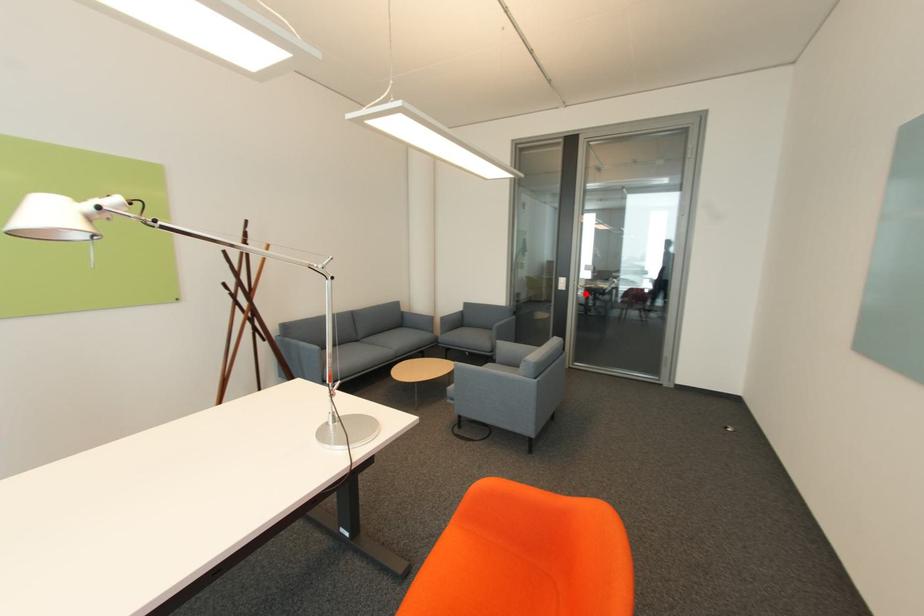
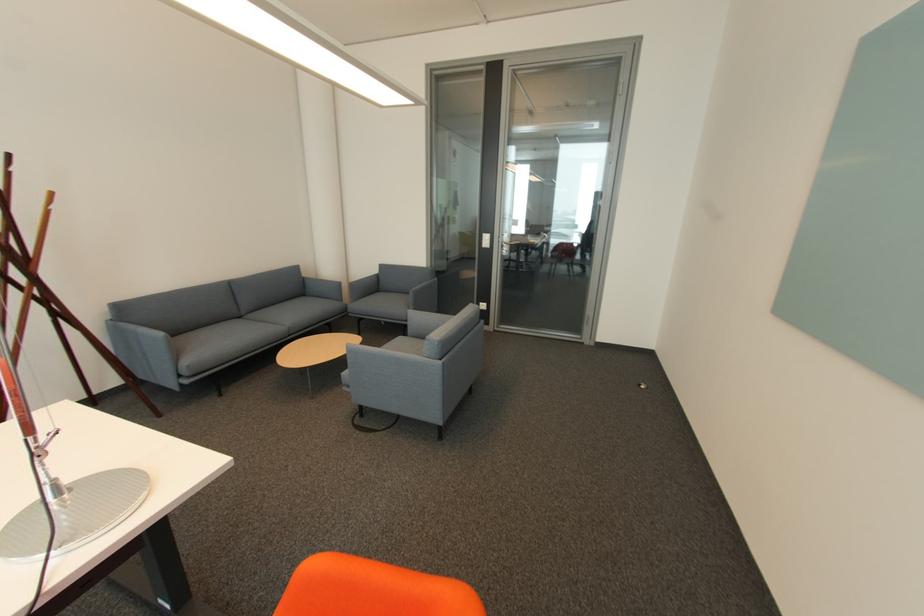
Question: I am providing you with two images of the same scene from different viewpoints. Image1 has a red point marked. In image2, the corresponding 3D location appears at what relative position? Reply with the corresponding letter.

Choices:
 (A) Closer
 (B) Farther

Answer: (A)